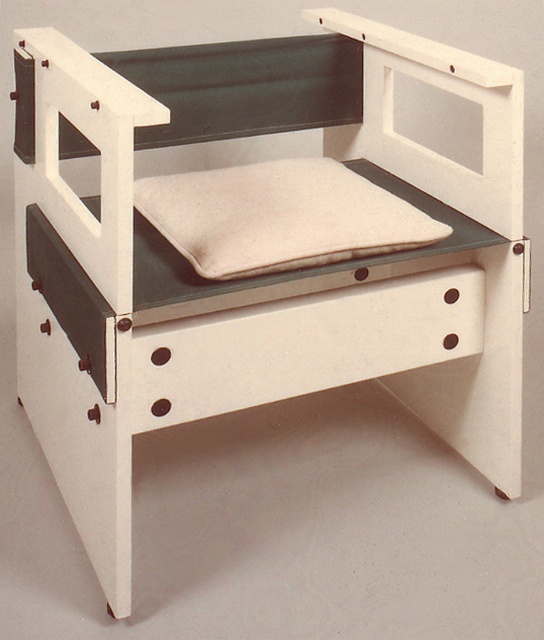
Question: Does white matte drawer at lower center appear on the left side of beige fabric cushion at center?

Choices:
 (A) no
 (B) yes

Answer: (A)

Question: Which point appears farthest from the camera in this image?

Choices:
 (A) (139, 179)
 (B) (350, 378)

Answer: (A)

Question: Is the position of white matte drawer at lower center less distant than that of beige fabric cushion at center?

Choices:
 (A) no
 (B) yes

Answer: (B)

Question: Which point appears closest to the camera in this image?

Choices:
 (A) (388, 340)
 (B) (275, 202)

Answer: (B)

Question: Is white matte drawer at lower center closer to the viewer compared to beige fabric cushion at center?

Choices:
 (A) no
 (B) yes

Answer: (B)